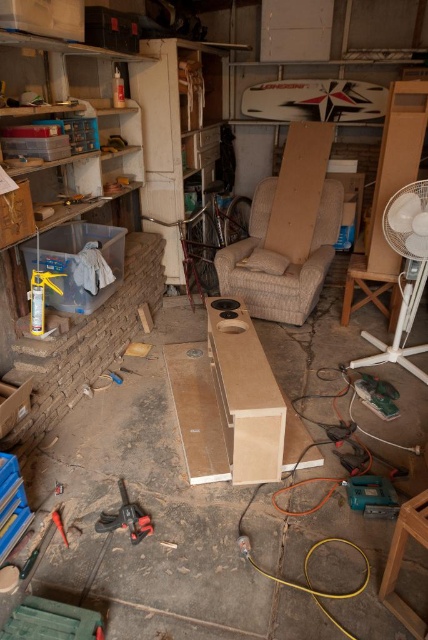
Question: Among these objects, which one is nearest to the camera?

Choices:
 (A) matte brown cardboard box at left
 (B) beige fabric armchair at center

Answer: (A)

Question: Among these points, which one is nearest to the camera?

Choices:
 (A) (67, 541)
 (B) (419, 285)

Answer: (A)

Question: Which object appears farthest from the camera in this image?

Choices:
 (A) black rubber drill at lower left
 (B) metal/brushed power drill at lower left
 (C) white plastic fan at right

Answer: (C)

Question: Does translucent plastic box at left have a smaller size compared to matte brown cardboard box at left?

Choices:
 (A) yes
 (B) no

Answer: (B)

Question: Is white plastic fan at right below black rubber drill at lower left?

Choices:
 (A) yes
 (B) no

Answer: (B)

Question: Is beige fabric armchair at center smaller than matte brown cardboard box at left?

Choices:
 (A) yes
 (B) no

Answer: (B)